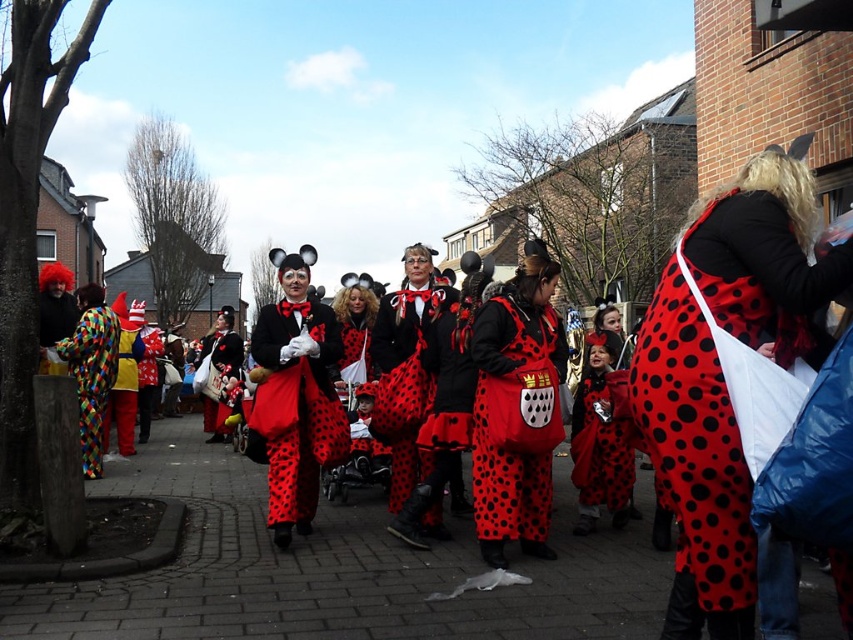
Question: Which point appears closest to the camera in this image?

Choices:
 (A) (115, 340)
 (B) (531, 492)
 (C) (676, 326)
 (D) (587, 419)

Answer: (C)

Question: Observing the image, what is the correct spatial positioning of red dotted fabric dress at center in reference to red polka dot dress at center?

Choices:
 (A) above
 (B) below

Answer: (A)

Question: Is red polka dot dress at center closer to camera compared to multicolored fabric clown at left?

Choices:
 (A) no
 (B) yes

Answer: (B)

Question: Can you confirm if red polka dot dress at center is positioned to the left of matte yellow clown suit at left?

Choices:
 (A) yes
 (B) no

Answer: (B)

Question: Which object appears farthest from the camera in this image?

Choices:
 (A) polka dot fabric dress at center
 (B) multicolored fabric clown at left

Answer: (B)

Question: Which point is closer to the camera?

Choices:
 (A) (404, 440)
 (B) (99, 449)

Answer: (A)